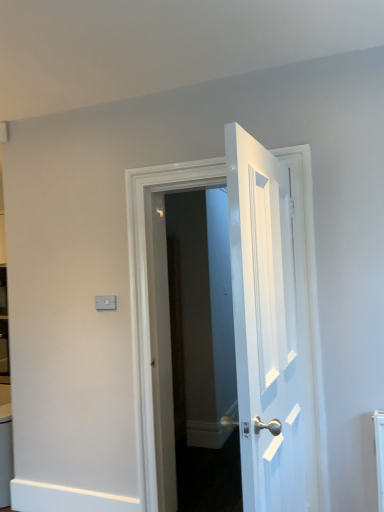
Find the location of a particular element. This screenshot has width=384, height=512. white glossy door at center, the second door viewed from the back is located at coordinates (265, 326).

Describe the element at coordinates (265, 326) in the screenshot. I see `white glossy door at center, the second door viewed from the back` at that location.

You are a GUI agent. You are given a task and a screenshot of the screen. Output one action in this format:
    pyautogui.click(x=<x>, y=<y>)
    Task: Click on the white wooden door at center, the 1th door when ordered from back to front
    This screenshot has height=512, width=384.
    Given the screenshot: What is the action you would take?
    pyautogui.click(x=148, y=294)

This screenshot has width=384, height=512. Describe the element at coordinates (148, 294) in the screenshot. I see `white wooden door at center, the 1th door when ordered from back to front` at that location.

What are the coordinates of `white glossy door at center, the first door from the front` in the screenshot? It's located at 265,326.

Which object is positioned more to the left, white glossy door at center, the second door viewed from the back, or white wooden door at center, the second door from the front?

white wooden door at center, the second door from the front, is more to the left.

Considering their positions, is white glossy door at center, the second door viewed from the back, located in front of or behind white wooden door at center, the second door from the front?

Clearly, white glossy door at center, the second door viewed from the back, is in front of white wooden door at center, the second door from the front.

Which is closer to the camera, (265, 303) or (310, 298)?

Point (265, 303) is closer to the camera than point (310, 298).

From the image's perspective, between white glossy door at center, the second door viewed from the back, and white wooden door at center, the second door from the front, who is located below?

white wooden door at center, the second door from the front, is shown below in the image.

From a real-world perspective, does white glossy door at center, the second door viewed from the back, stand above white wooden door at center, the second door from the front?

Indeed, from a real-world perspective, white glossy door at center, the second door viewed from the back, stands above white wooden door at center, the second door from the front.

Does white glossy door at center, the second door viewed from the back, have a greater width compared to white wooden door at center, the second door from the front?

Incorrect, the width of white glossy door at center, the second door viewed from the back, does not surpass that of white wooden door at center, the second door from the front.

Looking at this image, from their relative heights in the image, would you say white glossy door at center, the second door viewed from the back, is taller or shorter than white wooden door at center, the 1th door when ordered from back to front?

Clearly, white glossy door at center, the second door viewed from the back, is shorter compared to white wooden door at center, the 1th door when ordered from back to front.

Which of these two, white glossy door at center, the first door from the front, or white wooden door at center, the 1th door when ordered from back to front, is smaller?

Smaller between the two is white glossy door at center, the first door from the front.

Looking at this image, is white glossy door at center, the first door from the front, spatially inside white wooden door at center, the 1th door when ordered from back to front, or outside of it?

white glossy door at center, the first door from the front, is not inside white wooden door at center, the 1th door when ordered from back to front, it's outside.

Is white glossy door at center, the second door viewed from the back, not near white wooden door at center, the second door from the front?

white glossy door at center, the second door viewed from the back, is near white wooden door at center, the second door from the front, not far away.

Is white glossy door at center, the first door from the front, aimed at white wooden door at center, the second door from the front?

No, white glossy door at center, the first door from the front, is not aimed at white wooden door at center, the second door from the front.

How different are the orientations of white glossy door at center, the second door viewed from the back, and white wooden door at center, the second door from the front, in degrees?

white glossy door at center, the second door viewed from the back, and white wooden door at center, the second door from the front, are facing 93.1 degrees away from each other.

Locate an element on the screen. The image size is (384, 512). door on the right of white wooden door at center, the 1th door when ordered from back to front is located at coordinates (265, 326).

Which object is positioned more to the right, white wooden door at center, the second door from the front, or white glossy door at center, the first door from the front?

white glossy door at center, the first door from the front.

Looking at this image, who is more distant, white wooden door at center, the second door from the front, or white glossy door at center, the second door viewed from the back?

Positioned behind is white wooden door at center, the second door from the front.

Which is closer to the camera, (139, 357) or (273, 377)?

The point (273, 377) is closer to the camera.

From the image's perspective, is white wooden door at center, the 1th door when ordered from back to front, above or below white glossy door at center, the second door viewed from the back?

Based on their image positions, white wooden door at center, the 1th door when ordered from back to front, is located beneath white glossy door at center, the second door viewed from the back.

From a real-world perspective, who is located higher, white wooden door at center, the second door from the front, or white glossy door at center, the first door from the front?

From a 3D spatial view, white glossy door at center, the first door from the front, is above.

Which object is thinner, white wooden door at center, the second door from the front, or white glossy door at center, the second door viewed from the back?

white glossy door at center, the second door viewed from the back, is thinner.

Is white wooden door at center, the 1th door when ordered from back to front, taller or shorter than white glossy door at center, the first door from the front?

In the image, white wooden door at center, the 1th door when ordered from back to front, appears to be taller than white glossy door at center, the first door from the front.

Is white wooden door at center, the second door from the front, smaller than white glossy door at center, the second door viewed from the back?

Incorrect, white wooden door at center, the second door from the front, is not smaller in size than white glossy door at center, the second door viewed from the back.

Consider the image. Do you think white wooden door at center, the 1th door when ordered from back to front, is within white glossy door at center, the first door from the front, or outside of it?

white wooden door at center, the 1th door when ordered from back to front, is not enclosed by white glossy door at center, the first door from the front.

Is white wooden door at center, the second door from the front, next to white glossy door at center, the second door viewed from the back?

No, white wooden door at center, the second door from the front, is not making contact with white glossy door at center, the second door viewed from the back.

Could you tell me if white wooden door at center, the second door from the front, is facing white glossy door at center, the first door from the front?

Yes, white wooden door at center, the second door from the front, is oriented towards white glossy door at center, the first door from the front.

Measure the distance between white wooden door at center, the second door from the front, and white glossy door at center, the first door from the front.

A distance of 32.12 inches exists between white wooden door at center, the second door from the front, and white glossy door at center, the first door from the front.

You are a GUI agent. You are given a task and a screenshot of the screen. Output one action in this format:
    pyautogui.click(x=<x>, y=<y>)
    Task: Click on the door on the right side of white wooden door at center, the 1th door when ordered from back to front
    
    Given the screenshot: What is the action you would take?
    pyautogui.click(x=265, y=326)

Locate an element on the screen. The width and height of the screenshot is (384, 512). door below the white glossy door at center, the first door from the front (from the image's perspective) is located at coordinates (148, 294).

Identify the location of door that appears above the white wooden door at center, the 1th door when ordered from back to front (from a real-world perspective). (265, 326).